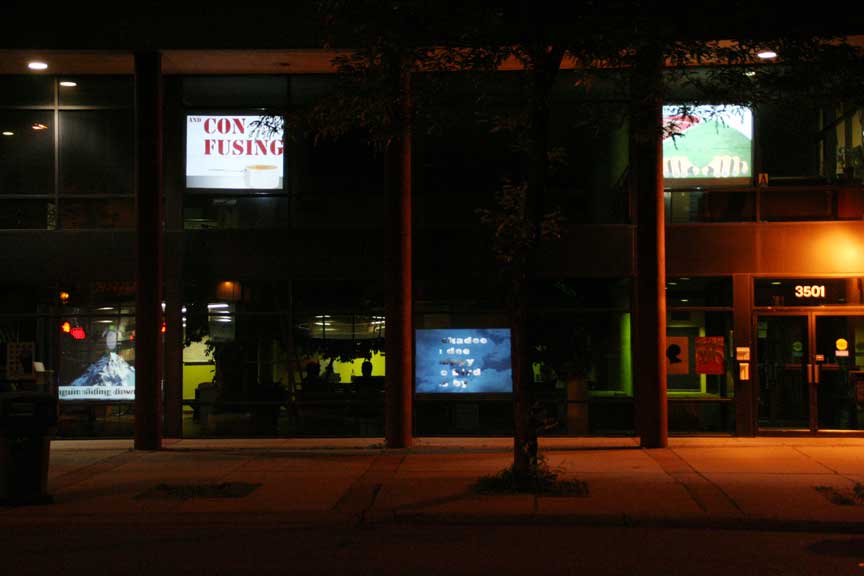
Where is `glass`? Image resolution: width=864 pixels, height=576 pixels. glass is located at coordinates (81, 137), (327, 181), (477, 170).